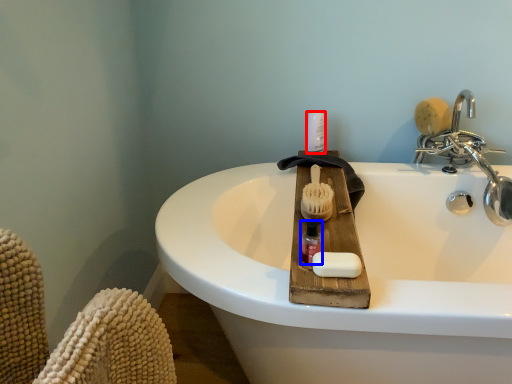
Question: Which point is closer to the camera, toiletry (highlighted by a red box) or mouthwash (highlighted by a blue box)?

Choices:
 (A) toiletry
 (B) mouthwash

Answer: (B)